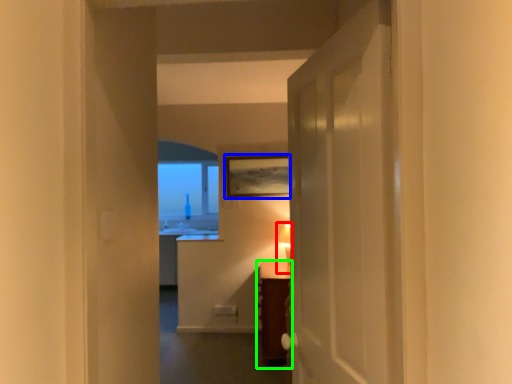
Question: Considering the real-world distances, which object is closest to table lamp (highlighted by a red box)? picture frame (highlighted by a blue box) or furniture (highlighted by a green box).

Choices:
 (A) picture frame
 (B) furniture

Answer: (A)